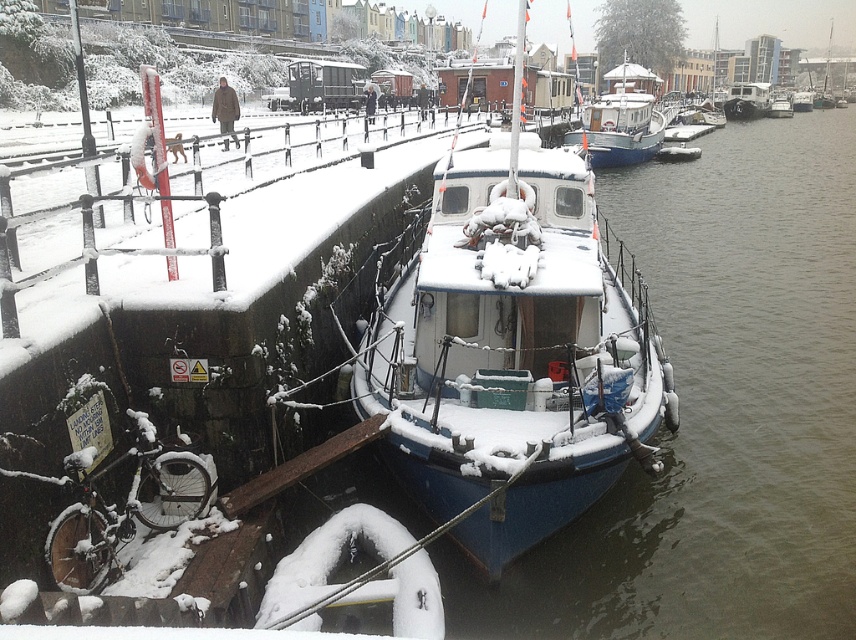
Question: Does blue matte boat at center have a larger size compared to white glossy boat at center?

Choices:
 (A) no
 (B) yes

Answer: (A)

Question: Which point is farther to the camera?

Choices:
 (A) (528, 342)
 (B) (646, 152)

Answer: (B)

Question: Which point appears closest to the camera in this image?

Choices:
 (A) (411, 413)
 (B) (610, 120)

Answer: (A)

Question: Is blue matte boat at center above white glossy boat at center?

Choices:
 (A) no
 (B) yes

Answer: (A)

Question: Can you confirm if blue matte boat at center is bigger than white glossy boat at center?

Choices:
 (A) yes
 (B) no

Answer: (B)